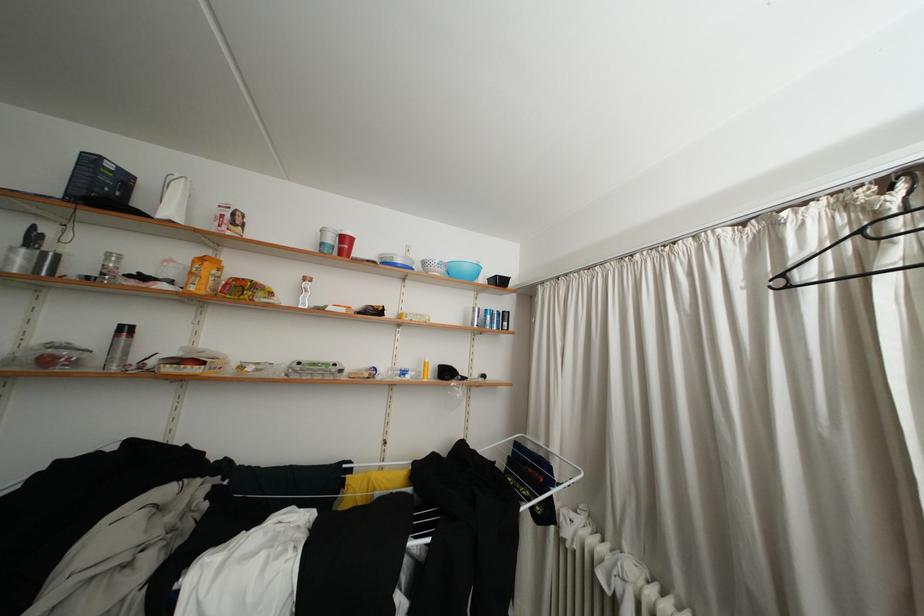
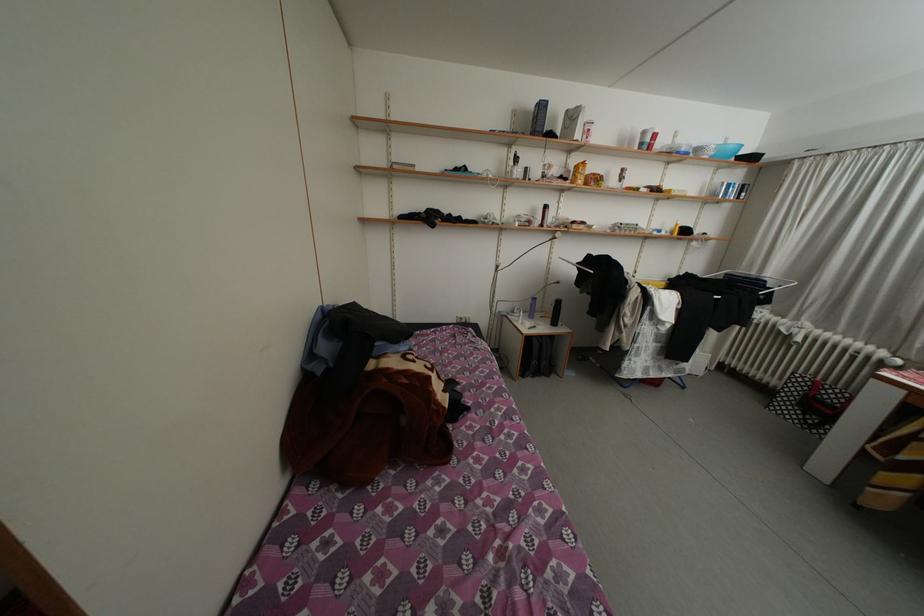
The point at (451, 276) is marked in the first image. Where is the corresponding point in the second image?

(721, 159)